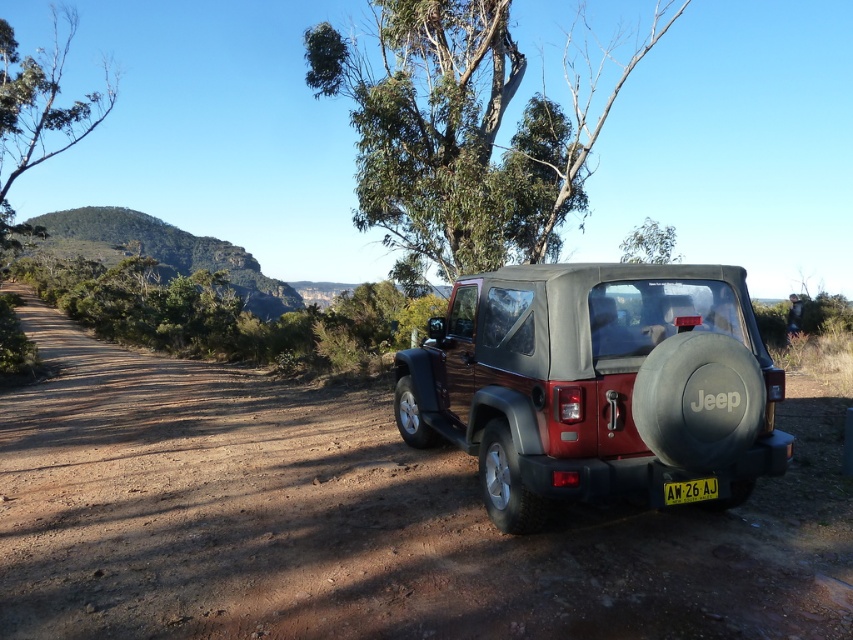
Does matte black jeep at right have a greater width compared to yellow matte license plate at rear?

Yes, matte black jeep at right is wider than yellow matte license plate at rear.

Who is higher up, matte black jeep at right or yellow matte license plate at rear?

Positioned higher is matte black jeep at right.

Identify the location of matte black jeep at right. The image size is (853, 640). (595, 385).

Is dirt field at center thinner than green leafy tree at upper center?

Indeed, dirt field at center has a lesser width compared to green leafy tree at upper center.

Does point (53, 474) come behind point (415, 163)?

No, it is not.

The width and height of the screenshot is (853, 640). In order to click on dirt field at center in this screenshot , I will do `click(364, 518)`.

The height and width of the screenshot is (640, 853). What do you see at coordinates (364, 518) in the screenshot?
I see `dirt field at center` at bounding box center [364, 518].

Who is positioned more to the left, dirt field at center or green leafy tree at left?

green leafy tree at left is more to the left.

Does point (657, 566) come behind point (39, 120)?

No.

Identify the location of dirt field at center. (364, 518).